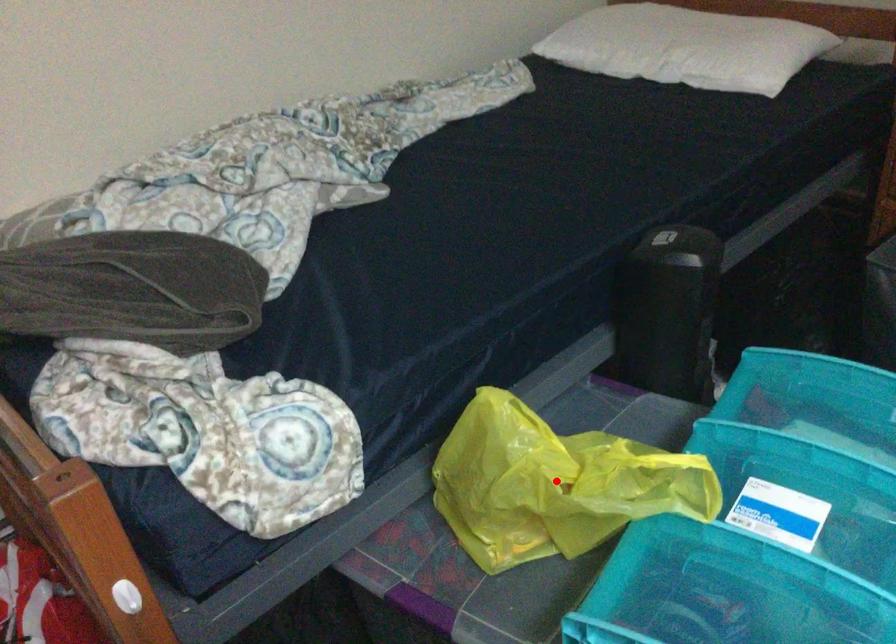
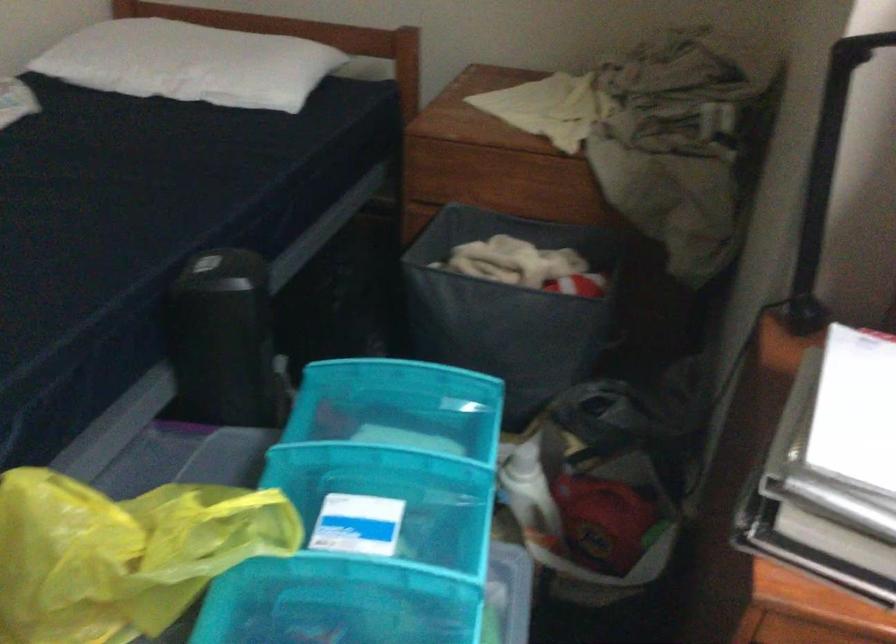
Question: I am providing you with two images of the same scene from different viewpoints. Image1 has a red point marked. In image2, the corresponding 3D location appears at what relative position? Reply with the corresponding letter.

Choices:
 (A) Closer
 (B) Farther

Answer: (A)